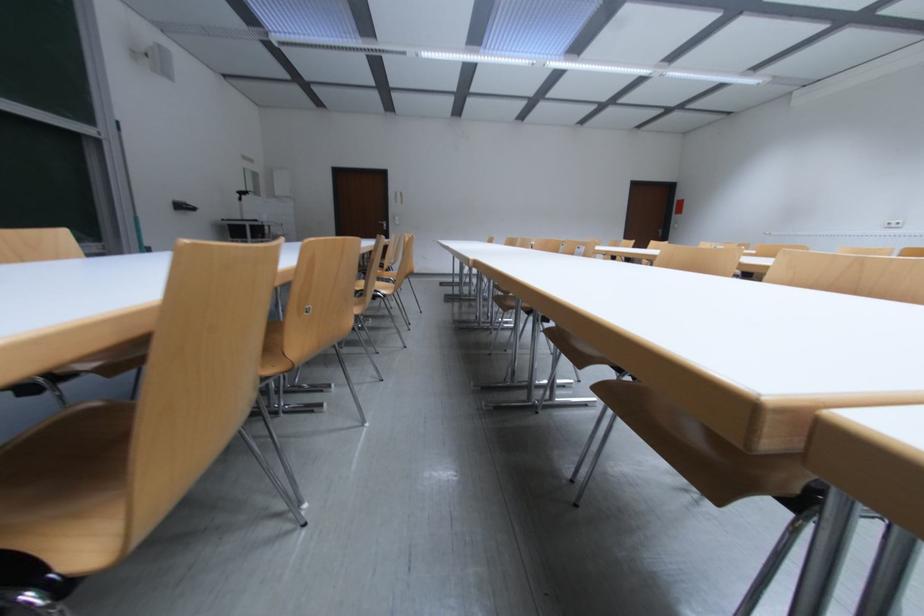
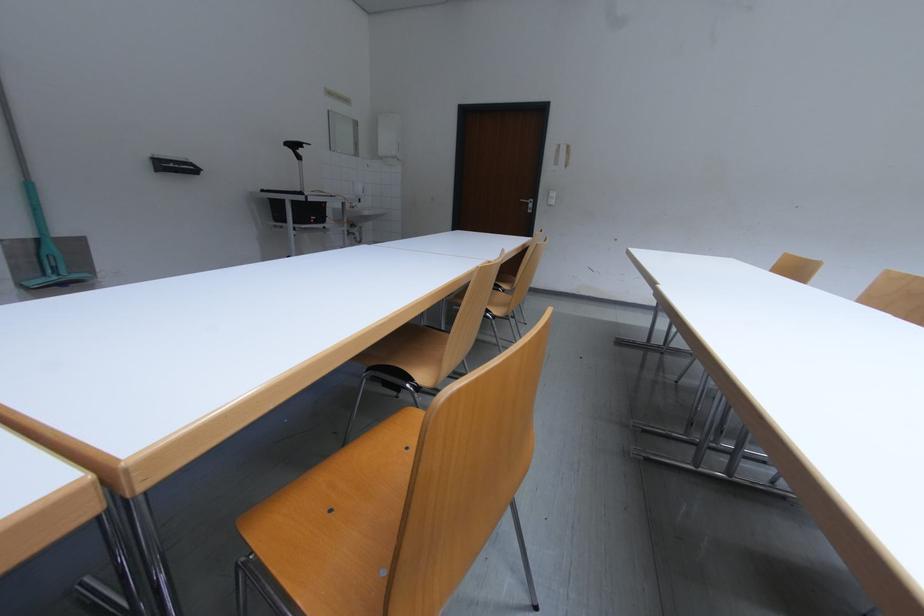
Question: What movement of the cameraman would produce the second image?

Choices:
 (A) Left
 (B) Right
 (C) Forward
 (D) Backward

Answer: (C)